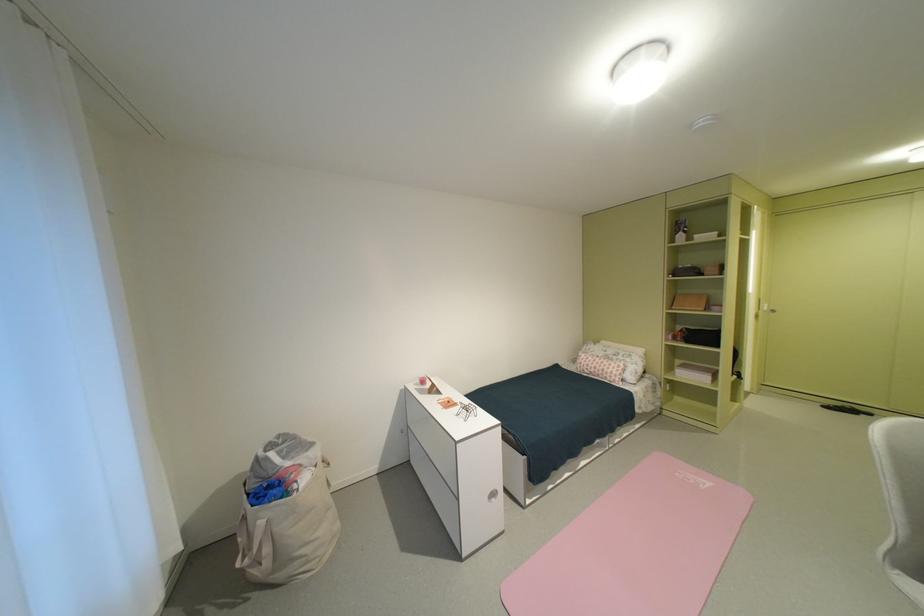
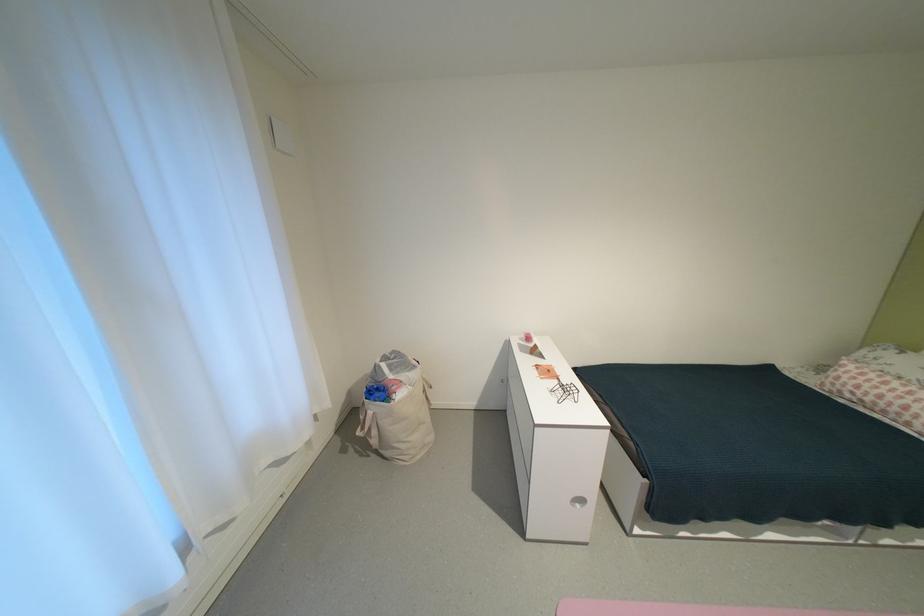
Find the pixel in the second image that matches [426,391] in the first image.

(529, 346)